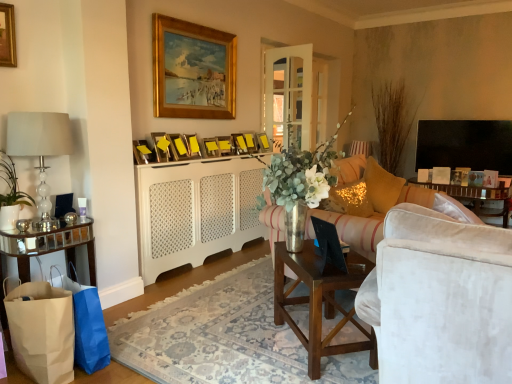
Question: Looking at their shapes, would you say mirrored glass table at lower left, the 2th table in the right-to-left sequence, is wider or thinner than yellow paper picture frame at upper center, acting as the 10th picture frame starting from the right?

Choices:
 (A) thin
 (B) wide

Answer: (B)

Question: Considering their positions, is mirrored glass table at lower left, which ranks as the 1th table in left-to-right order, located in front of or behind yellow paper picture frame at upper center, the second picture frame viewed from the left?

Choices:
 (A) behind
 (B) front

Answer: (B)

Question: Which is nearer to the metallic gold picture frame at center, positioned as the second picture frame in right-to-left order?

Choices:
 (A) yellow paper picture frame at upper center, the second picture frame viewed from the left
 (B) sparkly gold pillow at right, the second pillow viewed from the back
 (C) white paper bag at lower left, placed as the 2th shopping bag when sorted from front to back
 (D) metallic gold picture frame at center, marked as the seventh picture frame in a left-to-right arrangement
 (E) gold wooden picture frame at upper left, arranged as the eleventh picture frame when viewed from the right

Answer: (D)

Question: Estimate the real-world distances between objects in this image. Which object is farther from the matte gold picture frame at center, acting as the ninth picture frame starting from the right?

Choices:
 (A) white ceramic vase at left
 (B) brown paper bag at lower left, which is counted as the 1th shopping bag, starting from the front
 (C) glittery yellow pillow at right, positioned as the 2th pillow in front-to-back order
 (D) white paper bag at lower left, placed as the 2th shopping bag when sorted from front to back
 (E) metallic gold picture frame at center, arranged as the 10th picture frame when viewed from the left

Answer: (C)